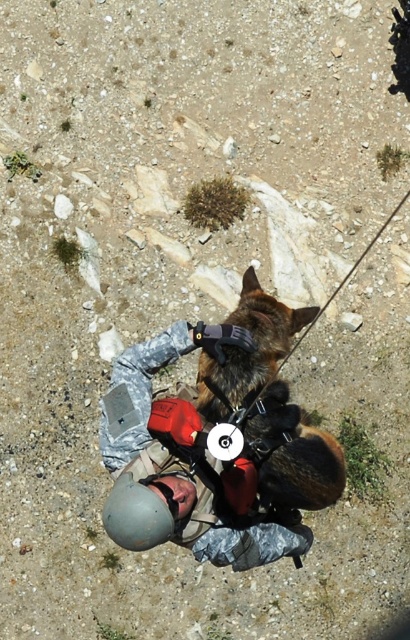
Can you confirm if camouflage fabric helmet at center is thinner than brown fur dog at center?

Incorrect, camouflage fabric helmet at center's width is not less than brown fur dog at center's.

Between camouflage fabric helmet at center and brown fur dog at center, which one has more height?

brown fur dog at center

Measure the distance between point (141, 461) and camera.

They are 8.17 meters apart.

At what (x,y) coordinates should I click in order to perform the action: click on camouflage fabric helmet at center. Please return your answer as a coordinate pair (x, y). This screenshot has width=410, height=640. Looking at the image, I should click on (166, 458).

Is camouflage fabric helmet at center behind gray matte helmet at lower center?

Yes, camouflage fabric helmet at center is behind gray matte helmet at lower center.

Can you confirm if camouflage fabric helmet at center is taller than gray matte helmet at lower center?

Correct, camouflage fabric helmet at center is much taller as gray matte helmet at lower center.

In order to click on camouflage fabric helmet at center in this screenshot , I will do `click(166, 458)`.

At what (x,y) coordinates should I click in order to perform the action: click on camouflage fabric helmet at center. Please return your answer as a coordinate pair (x, y). Looking at the image, I should click on (166, 458).

Is brown fur dog at center smaller than gray matte helmet at lower center?

Actually, brown fur dog at center might be larger than gray matte helmet at lower center.

What do you see at coordinates (248, 353) in the screenshot? This screenshot has height=640, width=410. I see `brown fur dog at center` at bounding box center [248, 353].

Is point (309, 508) behind point (125, 547)?

Yes.

Find the location of `brown fur dog at center`. brown fur dog at center is located at coordinates (248, 353).